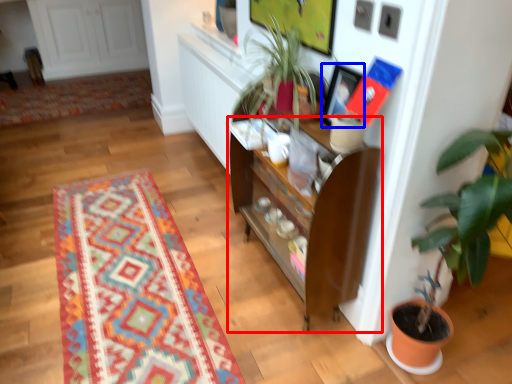
Question: Which of the following is the closest to the observer, cabinetry (highlighted by a red box) or picture frame (highlighted by a blue box)?

Choices:
 (A) cabinetry
 (B) picture frame

Answer: (A)